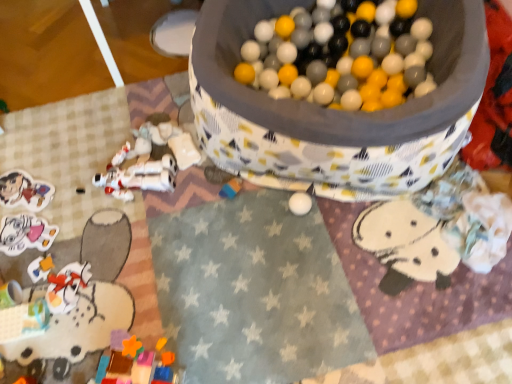
Image resolution: width=512 pixels, height=384 pixels. Find the location of `free space between white plastic astronaut at lower left, placed as the 3th toy when sorted from right to left, and multicolored plastic blocks at center, acting as the 5th toy starting from the left`. free space between white plastic astronaut at lower left, placed as the 3th toy when sorted from right to left, and multicolored plastic blocks at center, acting as the 5th toy starting from the left is located at coordinates (196, 189).